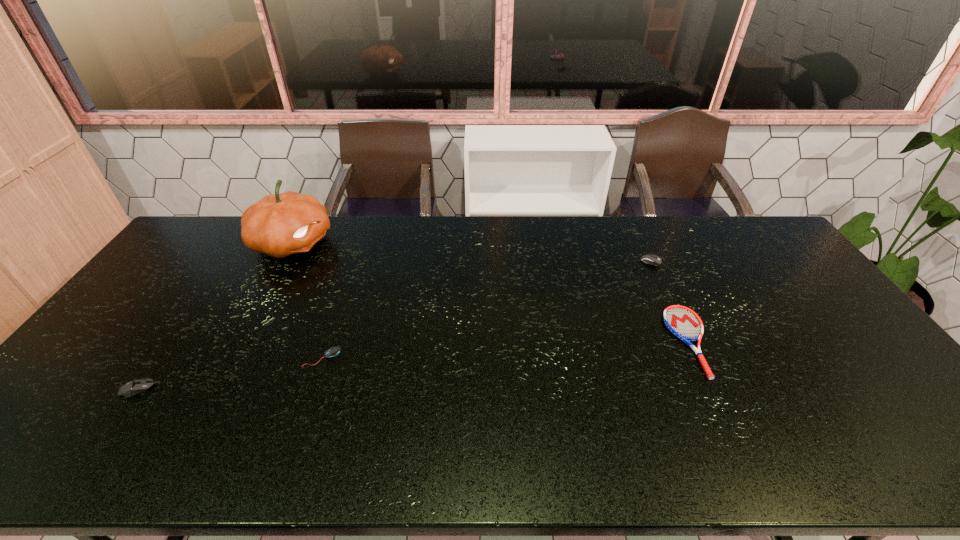
Find the location of a particular element. free location that satisfies the following two spatial constraints: 1. on the back side of the second farthest mouse; 2. on the right side of the tennis racket is located at coordinates (327, 341).

The height and width of the screenshot is (540, 960). I want to click on vacant space that satisfies the following two spatial constraints: 1. on the back side of the tennis racket; 2. on the left side of the nearest object, so click(x=173, y=341).

The width and height of the screenshot is (960, 540). In order to click on vacant point that satisfies the following two spatial constraints: 1. on the front face of the pumpkin; 2. on the right side of the rightmost mouse in this screenshot , I will do `click(284, 259)`.